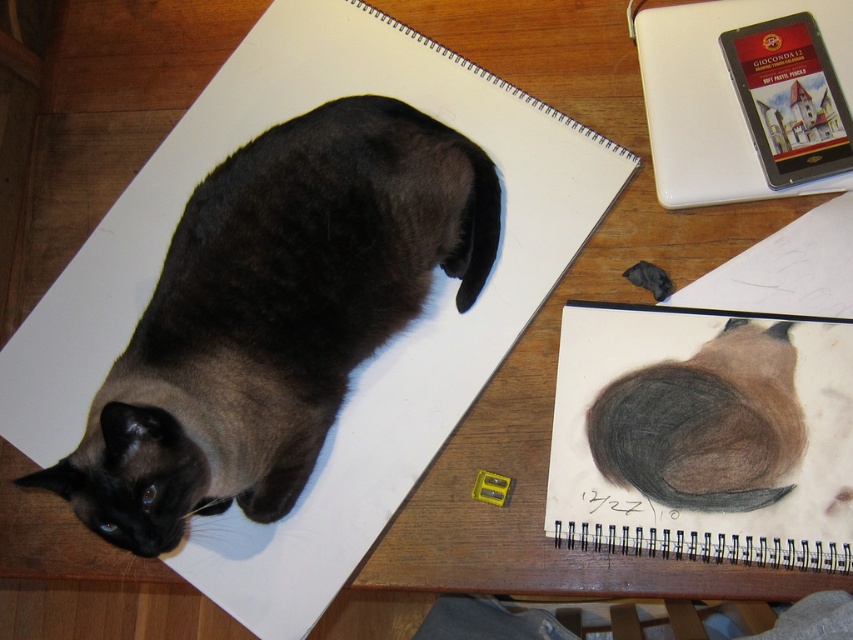
Question: Is charcoal sketchbook at center to the right of white matte notebook at upper right from the viewer's perspective?

Choices:
 (A) no
 (B) yes

Answer: (A)

Question: Does charcoal sketchbook at center come in front of white matte notebook at upper right?

Choices:
 (A) no
 (B) yes

Answer: (B)

Question: In this image, where is charcoal sketchbook at center located relative to white matte notebook at upper right?

Choices:
 (A) right
 (B) left

Answer: (B)

Question: Which is nearer to the charcoal sketchbook at center?

Choices:
 (A) dark brown fur cat at upper left
 (B) white matte notebook at upper right

Answer: (B)

Question: Which of the following is the closest to the observer?

Choices:
 (A) (721, 346)
 (B) (239, 152)
 (C) (659, 132)

Answer: (A)

Question: Which point is farther to the camera?

Choices:
 (A) charcoal sketchbook at center
 (B) white matte notebook at upper right

Answer: (B)